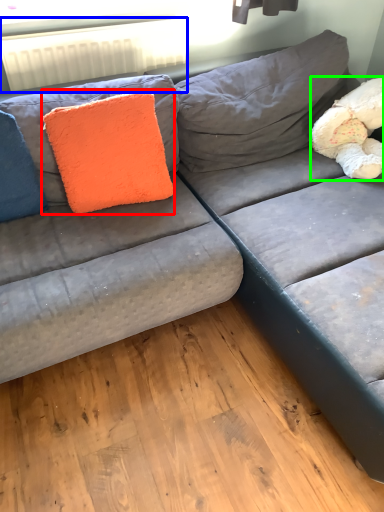
Question: Estimate the real-world distances between objects in this image. Which object is closer to throw pillow (highlighted by a red box), radiator (highlighted by a blue box) or teddy (highlighted by a green box)?

Choices:
 (A) radiator
 (B) teddy

Answer: (A)